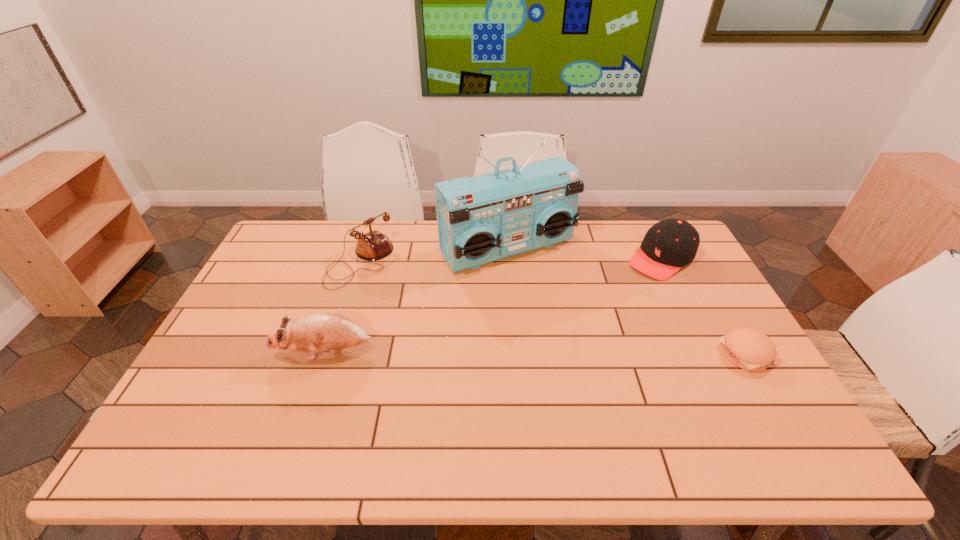
You are a GUI agent. You are given a task and a screenshot of the screen. Output one action in this format:
    pyautogui.click(x=<x>, y=<y>)
    Task: Click on the hamster
    
    Given the screenshot: What is the action you would take?
    pyautogui.click(x=317, y=332)

Where is `patty`? The width and height of the screenshot is (960, 540). patty is located at coordinates (747, 348).

At what (x,y) coordinates should I click in order to perform the action: click on telephone. Please return your answer as a coordinate pair (x, y). Looking at the image, I should click on pos(372,246).

Where is `the third object from left to right`? The width and height of the screenshot is (960, 540). the third object from left to right is located at coordinates (481, 219).

The image size is (960, 540). In order to click on radio receiver in this screenshot , I will do `click(481, 219)`.

Locate an element on the screen. This screenshot has height=540, width=960. cap is located at coordinates (670, 244).

The image size is (960, 540). Identify the location of free space located at the face of the hamster. (253, 352).

This screenshot has width=960, height=540. I want to click on vacant region located at the face of the hamster, so click(x=235, y=352).

At what (x,y) coordinates should I click in order to perform the action: click on vacant region located 0.370m on the back of the patty. Please return your answer as a coordinate pair (x, y). Looking at the image, I should click on (689, 254).

This screenshot has height=540, width=960. Find the location of `free spot located on the rotary dial of the telephone`. free spot located on the rotary dial of the telephone is located at coordinates (437, 325).